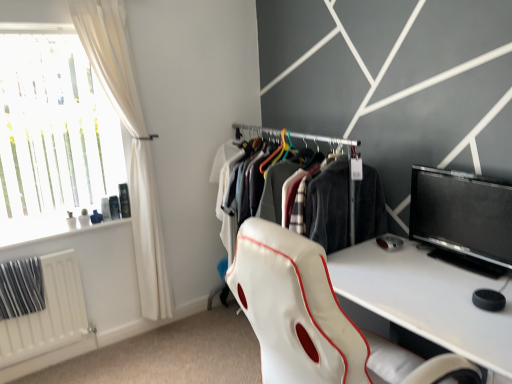
Question: Can you confirm if white leather chair at center is positioned to the right of translucent glass window at upper left?

Choices:
 (A) no
 (B) yes

Answer: (B)

Question: Is white leather chair at center outside translucent glass window at upper left?

Choices:
 (A) yes
 (B) no

Answer: (A)

Question: Are white leather chair at center and translucent glass window at upper left making contact?

Choices:
 (A) no
 (B) yes

Answer: (A)

Question: Is white leather chair at center bigger than translucent glass window at upper left?

Choices:
 (A) yes
 (B) no

Answer: (A)

Question: From the image's perspective, would you say white leather chair at center is shown under translucent glass window at upper left?

Choices:
 (A) yes
 (B) no

Answer: (A)

Question: Would you say white leather chair at center contains translucent glass window at upper left?

Choices:
 (A) no
 (B) yes

Answer: (A)

Question: Can we say black glossy monitor at right lies outside white matte radiator at lower left?

Choices:
 (A) no
 (B) yes

Answer: (B)

Question: Is black glossy monitor at right oriented towards white matte radiator at lower left?

Choices:
 (A) yes
 (B) no

Answer: (B)

Question: Considering the relative sizes of black glossy monitor at right and white matte radiator at lower left in the image provided, is black glossy monitor at right wider than white matte radiator at lower left?

Choices:
 (A) no
 (B) yes

Answer: (B)

Question: Considering the relative sizes of black glossy monitor at right and white matte radiator at lower left in the image provided, is black glossy monitor at right shorter than white matte radiator at lower left?

Choices:
 (A) yes
 (B) no

Answer: (A)

Question: Is black glossy monitor at right bigger than white matte radiator at lower left?

Choices:
 (A) no
 (B) yes

Answer: (B)

Question: Can you confirm if black glossy monitor at right is thinner than white matte radiator at lower left?

Choices:
 (A) yes
 (B) no

Answer: (B)

Question: Does translucent glass window at upper left appear on the left side of white matte radiator at lower left?

Choices:
 (A) no
 (B) yes

Answer: (A)